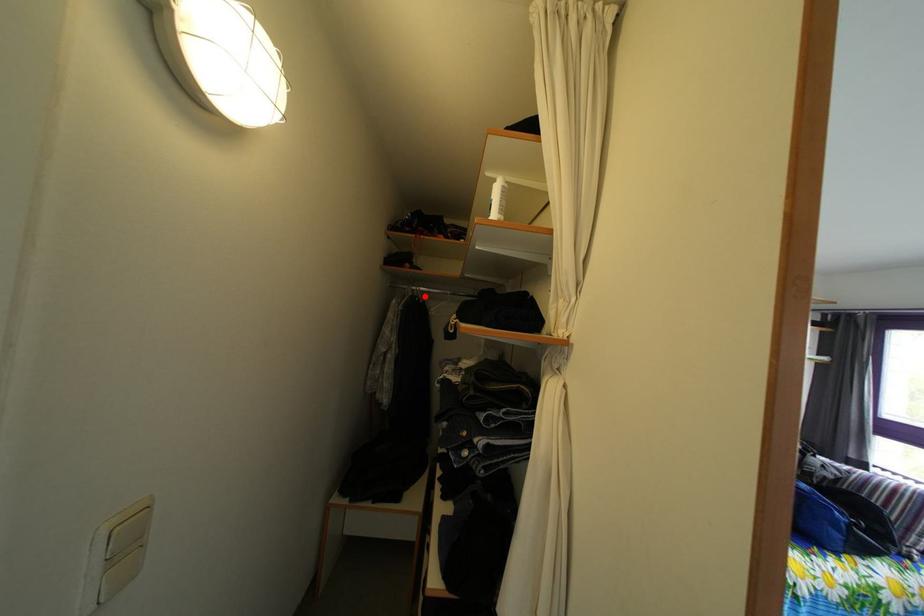
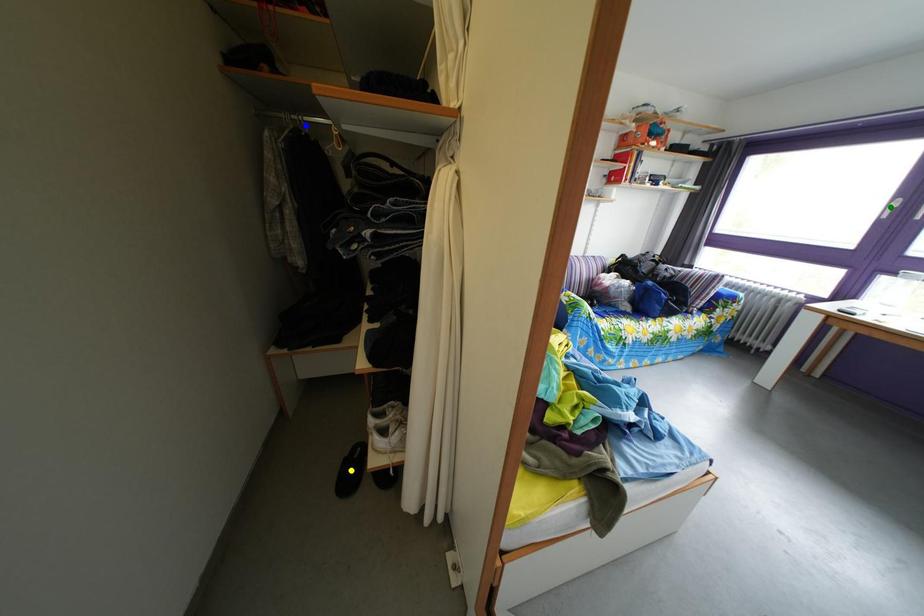
Question: I am providing you with two images of the same scene from different viewpoints. A red point is marked on the first image. You are given multiple points on the second image. In image 2, which mark is for the same physical point as the one in image 1?

Choices:
 (A) green point
 (B) yellow point
 (C) blue point

Answer: (C)